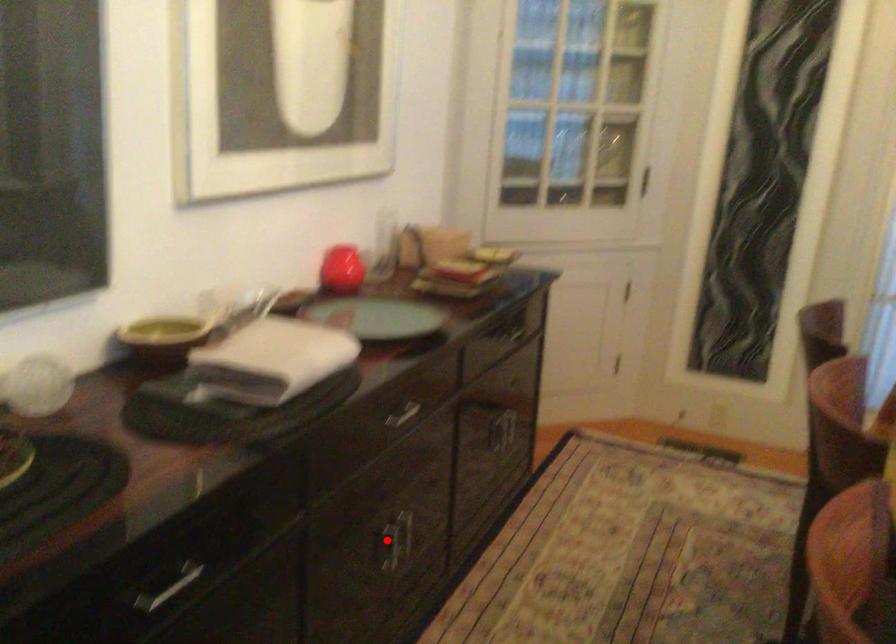
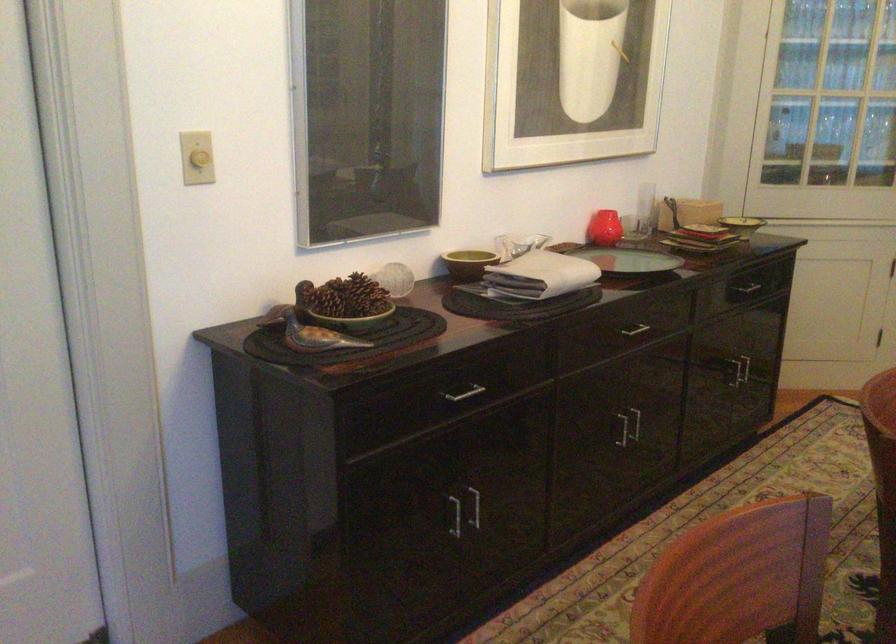
Find the pixel in the second image that matches the highlighted location in the first image.

(623, 429)